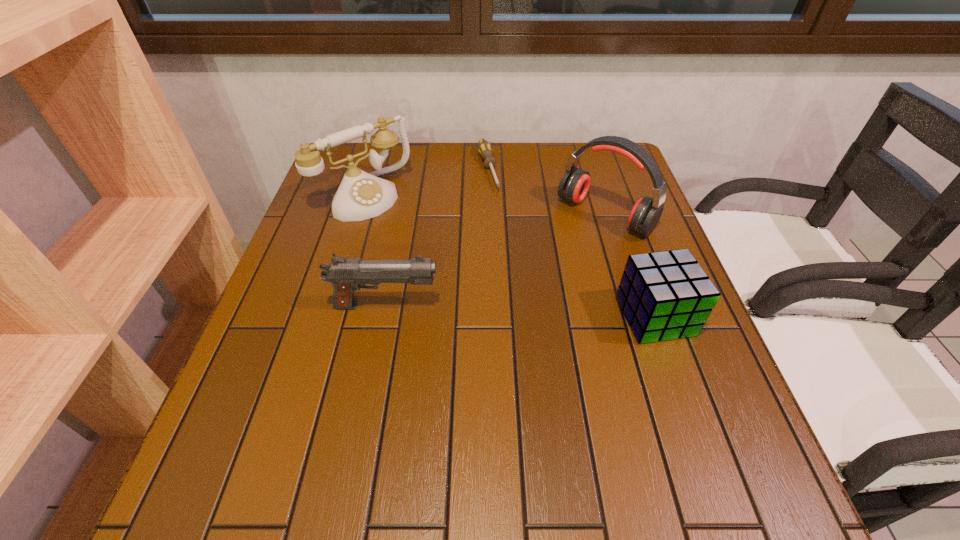
Locate an element on the screen. Image resolution: width=960 pixels, height=540 pixels. free region located on the dial of the telephone is located at coordinates pos(444,267).

Identify the location of free space located 0.330m on the ear cups of the earphone. (496, 314).

Find the location of a particular element. The height and width of the screenshot is (540, 960). vacant point located 0.260m on the ear cups of the earphone is located at coordinates (516, 295).

Image resolution: width=960 pixels, height=540 pixels. I want to click on vacant space located 0.210m on the ear cups of the earphone, so click(x=530, y=283).

I want to click on blank area located 0.340m at the tip of the third object from right to left, so click(x=519, y=281).

Image resolution: width=960 pixels, height=540 pixels. Identify the location of vacant area situated at the tip of the third object from right to left. (506, 240).

The width and height of the screenshot is (960, 540). I want to click on vacant space located 0.160m at the tip of the third object from right to left, so click(503, 230).

You are a GUI agent. You are given a task and a screenshot of the screen. Output one action in this format:
    pyautogui.click(x=<x>, y=<y>)
    Task: Click on the telephone situated at the far edge
    
    Given the screenshot: What is the action you would take?
    pyautogui.click(x=361, y=195)

The width and height of the screenshot is (960, 540). In order to click on screwdriver that is at the far edge in this screenshot , I will do `click(484, 147)`.

Where is `gun that is positioned at the left edge`? The width and height of the screenshot is (960, 540). gun that is positioned at the left edge is located at coordinates (346, 274).